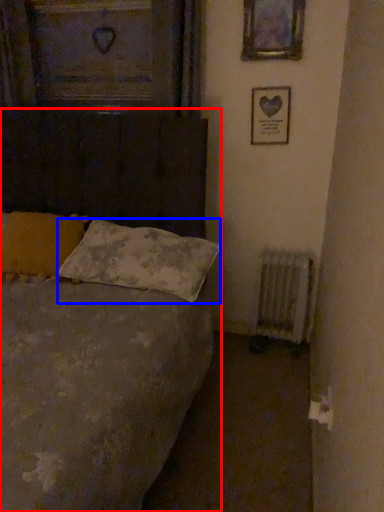
Question: Among these objects, which one is nearest to the camera, bed (highlighted by a red box) or pillow (highlighted by a blue box)?

Choices:
 (A) bed
 (B) pillow

Answer: (A)